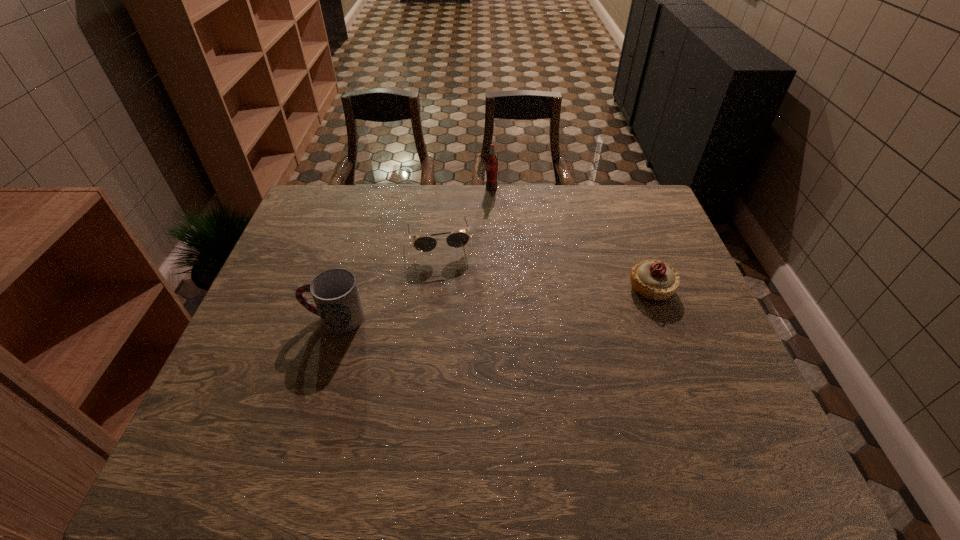
Where is `vacant space in between the tallest object and the third object from right to left`? vacant space in between the tallest object and the third object from right to left is located at coordinates (466, 214).

At what (x,y) coordinates should I click in order to perform the action: click on free space that is in between the tallest object and the second object from left to right. Please return your answer as a coordinate pair (x, y). Image resolution: width=960 pixels, height=540 pixels. Looking at the image, I should click on (466, 214).

Find the location of `vacant point located between the rightmost object and the third object from right to left`. vacant point located between the rightmost object and the third object from right to left is located at coordinates tap(545, 264).

Where is `vacant area between the rightmost object and the farthest object`? Image resolution: width=960 pixels, height=540 pixels. vacant area between the rightmost object and the farthest object is located at coordinates (571, 238).

Point out which object is positioned as the second nearest to the third object from left to right. Please provide its 2D coordinates. Your answer should be formatted as a tuple, i.e. [(x, y)], where the tuple contains the x and y coordinates of a point satisfying the conditions above.

[(652, 279)]

Identify the location of the second closest object relative to the third shortest object. This screenshot has height=540, width=960. (492, 162).